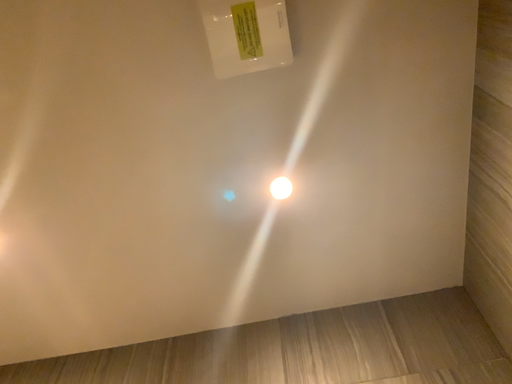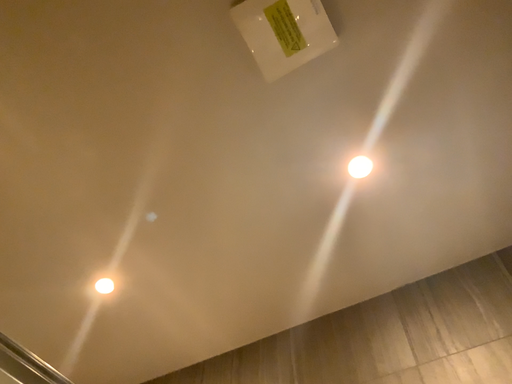
Question: How did the camera likely rotate when shooting the video?

Choices:
 (A) rotated left
 (B) rotated right

Answer: (A)